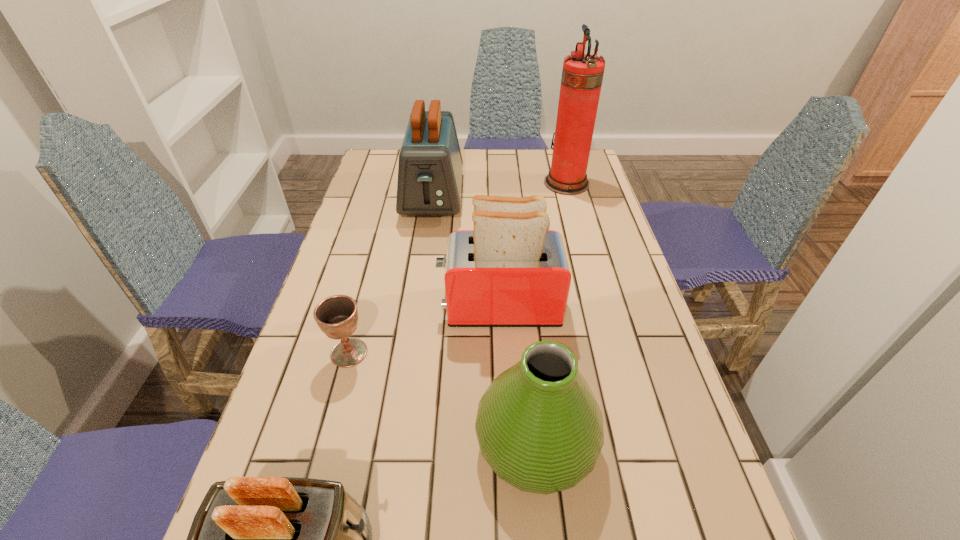
I want to click on the tallest object, so click(582, 75).

Locate an element on the screen. The image size is (960, 540). the farthest toaster is located at coordinates (430, 166).

Locate an element on the screen. The image size is (960, 540). the fourth nearest object is located at coordinates (511, 271).

Locate an element on the screen. The image size is (960, 540). vase is located at coordinates (x=539, y=427).

At what (x,y) coordinates should I click in order to perform the action: click on the fourth farthest object. Please return your answer as a coordinate pair (x, y). This screenshot has height=540, width=960. Looking at the image, I should click on (337, 316).

Where is `the shortest object`? The height and width of the screenshot is (540, 960). the shortest object is located at coordinates (337, 316).

Identify the location of blank space located 0.190m at the discharge end of the tallest object. (489, 183).

The height and width of the screenshot is (540, 960). Find the location of `vacant space situated at the discharge end of the tallest object`. vacant space situated at the discharge end of the tallest object is located at coordinates (515, 183).

Identify the location of vacant space situated at the discharge end of the tallest object. [471, 183].

Find the location of a particular element. This screenshot has width=960, height=540. free space located 0.380m on the front-facing side of the farthest toaster is located at coordinates (416, 322).